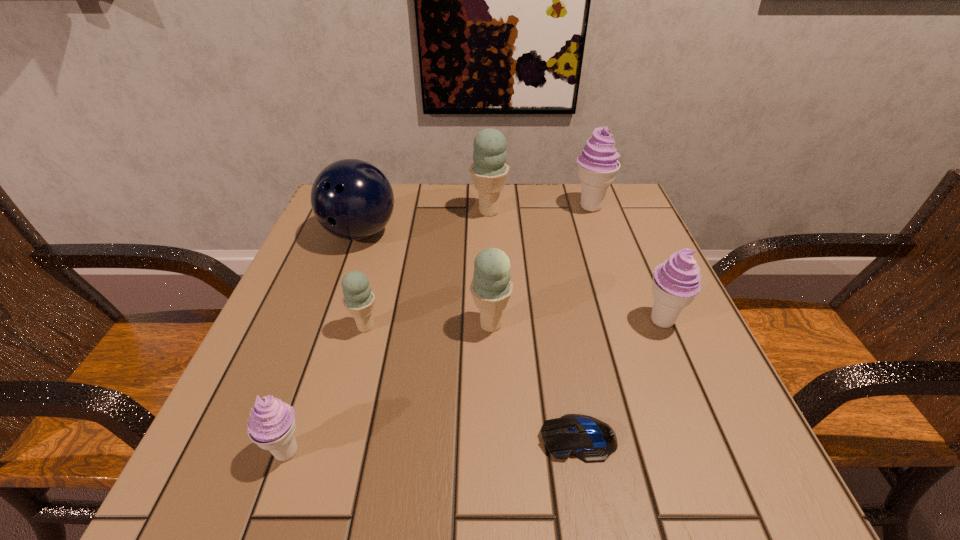
The height and width of the screenshot is (540, 960). I want to click on the farthest blue ice cream, so click(x=489, y=171).

The width and height of the screenshot is (960, 540). Identify the location of the biggest purple icecream. (598, 165).

Identify the location of bowling ball. (352, 199).

The height and width of the screenshot is (540, 960). Identify the location of the second biggest blue ice cream. (491, 287).

Locate an element on the screen. This screenshot has height=540, width=960. the second biggest purple icecream is located at coordinates (676, 282).

In order to click on the leftmost blue ice cream in this screenshot , I will do `click(359, 299)`.

At what (x,y) coordinates should I click in order to perform the action: click on the smallest blue ice cream. Please return your answer as a coordinate pair (x, y). The height and width of the screenshot is (540, 960). Looking at the image, I should click on (359, 299).

I want to click on the smallest purple icecream, so click(271, 425).

Locate an element on the screen. This screenshot has width=960, height=540. the nearest purple icecream is located at coordinates (271, 425).

The width and height of the screenshot is (960, 540). I want to click on computer mouse, so click(591, 440).